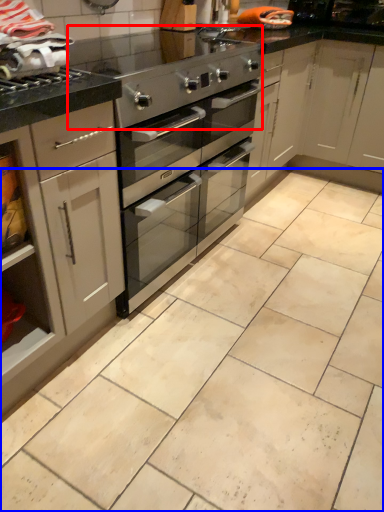
Question: Among these objects, which one is farthest to the camera, appliance (highlighted by a red box) or counter (highlighted by a blue box)?

Choices:
 (A) appliance
 (B) counter

Answer: (A)